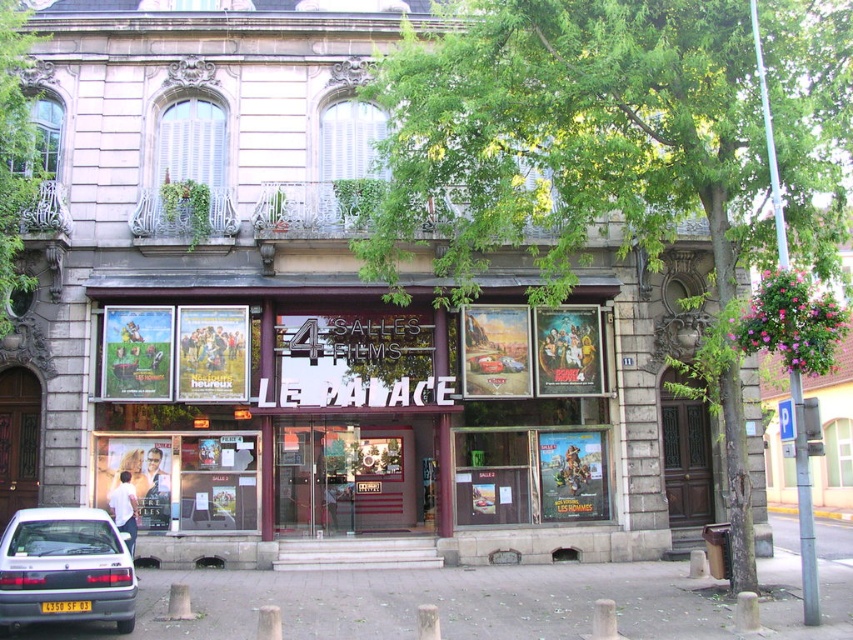
Between point (53, 572) and point (358, 220), which one is positioned behind?

The point (358, 220) is more distant.

Can you confirm if silver metallic hatchback at lower left is positioned below white wooden shutters at upper center?

Correct, silver metallic hatchback at lower left is located below white wooden shutters at upper center.

Is point (96, 608) behind point (357, 106)?

No.

What are the coordinates of `silver metallic hatchback at lower left` in the screenshot? It's located at (64, 568).

Does metallic glass windows at center lie behind green leafy plant at upper center?

No, metallic glass windows at center is closer to the viewer.

Does metallic glass windows at center appear on the right side of green leafy plant at upper center?

Correct, you'll find metallic glass windows at center to the right of green leafy plant at upper center.

Does point (466, 476) come in front of point (178, 157)?

That is True.

This screenshot has height=640, width=853. Identify the location of metallic glass windows at center. pyautogui.click(x=357, y=419).

Can you confirm if silver metallic hatchback at lower left is thinner than green leafy plant at upper center?

Yes.

The height and width of the screenshot is (640, 853). Describe the element at coordinates (64, 568) in the screenshot. I see `silver metallic hatchback at lower left` at that location.

Is point (105, 579) farther from viewer compared to point (189, 109)?

No, it is in front of (189, 109).

Identify the location of silver metallic hatchback at lower left. (64, 568).